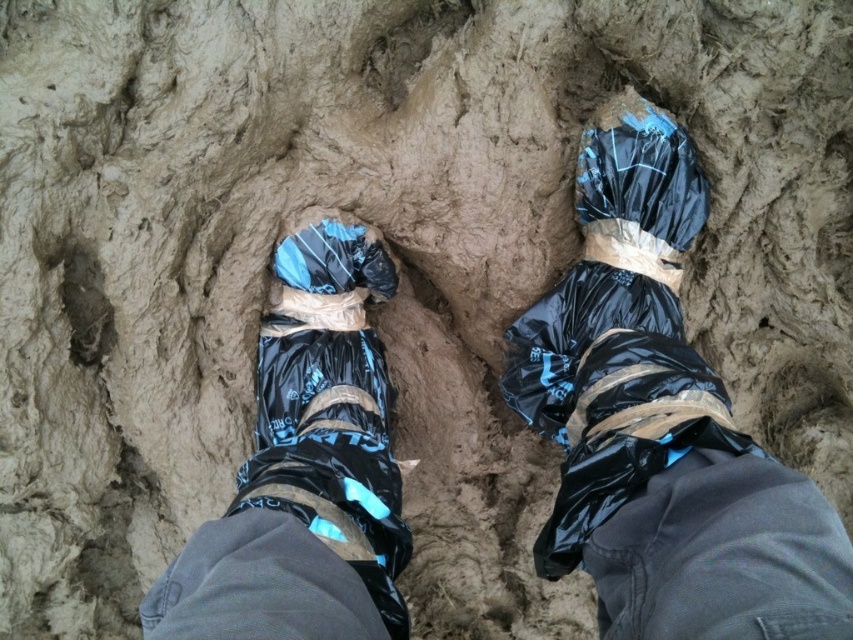
You are a hiker trying to avoid stepping in the muddy ground. You see your black plastic boots at center and a black plastic bag at center. Which object should you step on to stay out of the mud?

The black plastic bag at center is behind the black plastic boots at center, so stepping on the black plastic boots at center would keep you above the mud.

You are a hiker trying to cross a muddy area and see your two protective coverings on the ground. Which one is positioned to the right side of the other? The black plastic boots at center or the black plastic bag at center?

The black plastic boots at center are to the left of the black plastic bag at center, so the black plastic bag at center is positioned to the right side of the black plastic boots at center.

You are a hiker preparing to walk through a muddy trail. You have two options for footwear protection on your feet at the center of the image. The black plastic boots at center and the black plastic bag at center. Which one would provide better coverage for your feet considering their size?

The black plastic boots at center provide better coverage because their width is larger than the black plastic bag at center, offering more protection against the muddy surface.